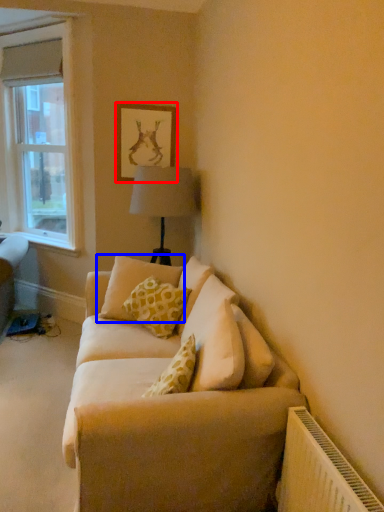
Question: Among these objects, which one is farthest to the camera, picture frame (highlighted by a red box) or pillow (highlighted by a blue box)?

Choices:
 (A) picture frame
 (B) pillow

Answer: (A)